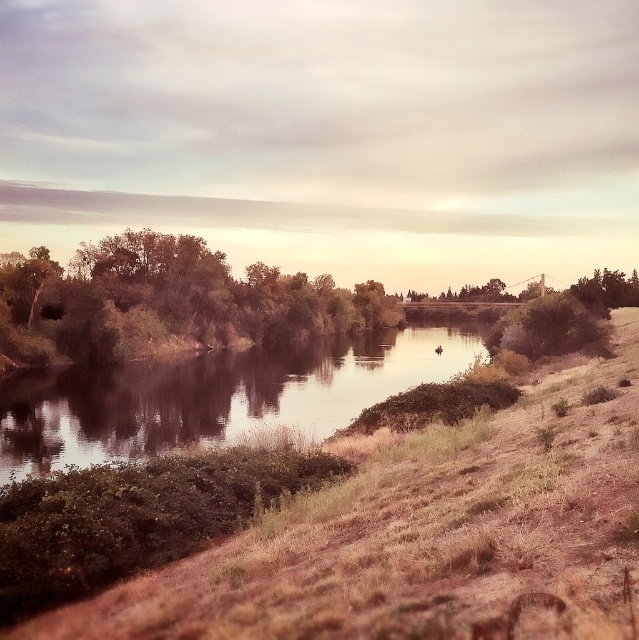
Does green leafy bush at right have a greater width compared to green leafy tree at right?

Incorrect, green leafy bush at right's width does not surpass green leafy tree at right's.

In the scene shown: Is green leafy bush at right further to camera compared to green leafy tree at right?

No, green leafy bush at right is in front of green leafy tree at right.

You are a GUI agent. You are given a task and a screenshot of the screen. Output one action in this format:
    pyautogui.click(x=<x>, y=<y>)
    Task: Click on the green leafy bush at right
    
    Given the screenshot: What is the action you would take?
    pyautogui.click(x=550, y=328)

Find the location of a particular element. The width and height of the screenshot is (639, 640). green leafy bush at right is located at coordinates (550, 328).

Is smooth reflective water at center positioned behind green leafy trees at left?

No, it is not.

Where is `smooth reflective water at center`? smooth reflective water at center is located at coordinates (217, 396).

Consider the image. Can you confirm if brown grassy hillside at lower left is positioned below green leafy tree at right?

Yes, brown grassy hillside at lower left is below green leafy tree at right.

Is brown grassy hillside at lower left thinner than green leafy tree at right?

Yes, brown grassy hillside at lower left is thinner than green leafy tree at right.

Which is in front, point (381, 604) or point (631, 285)?

Positioned in front is point (381, 604).

Identify the location of brown grassy hillside at lower left. The height and width of the screenshot is (640, 639). (424, 534).